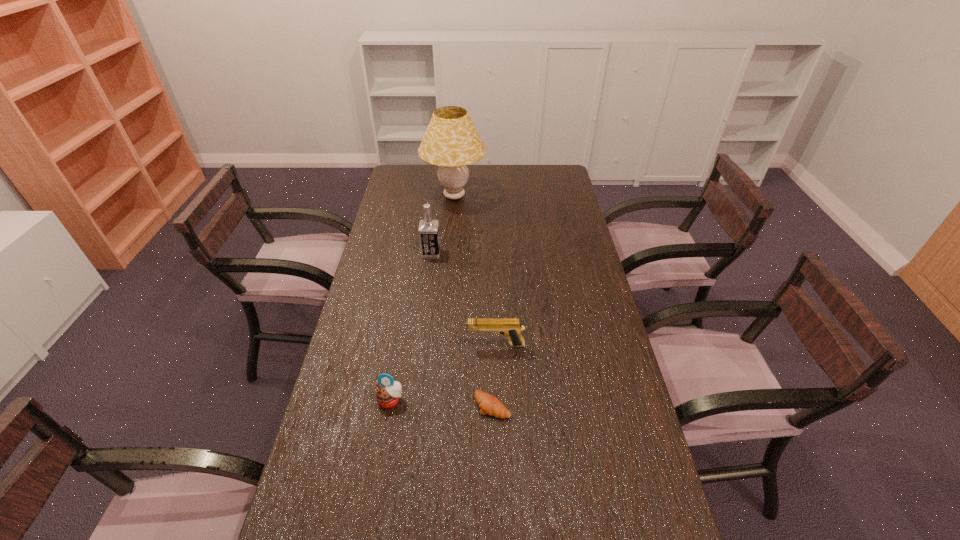
I want to click on lampshade, so click(451, 141).

This screenshot has width=960, height=540. What are the coordinates of `the farthest object` in the screenshot? It's located at (451, 141).

The image size is (960, 540). Find the location of `the fourth shortest object`. the fourth shortest object is located at coordinates [428, 230].

Locate an element on the screen. The height and width of the screenshot is (540, 960). the fourth nearest object is located at coordinates (428, 230).

The width and height of the screenshot is (960, 540). I want to click on pistol, so click(x=510, y=327).

You are a GUI agent. You are given a task and a screenshot of the screen. Output one action in this format:
    pyautogui.click(x=<x>, y=<y>)
    Task: Click on the muffin
    The width and height of the screenshot is (960, 540).
    Given the screenshot: What is the action you would take?
    pyautogui.click(x=388, y=393)

In order to click on crescent roll in this screenshot , I will do `click(488, 404)`.

This screenshot has height=540, width=960. Identify the location of vacant space located 0.060m on the back of the tallest object. (456, 174).

At what (x,y) coordinates should I click in order to perform the action: click on free space located 0.100m on the front label of the fourth nearest object. Please return your answer as a coordinate pair (x, y). The image size is (960, 540). Looking at the image, I should click on (466, 253).

The height and width of the screenshot is (540, 960). What are the coordinates of `free spot located at the barrel of the third nearest object` in the screenshot? It's located at (406, 345).